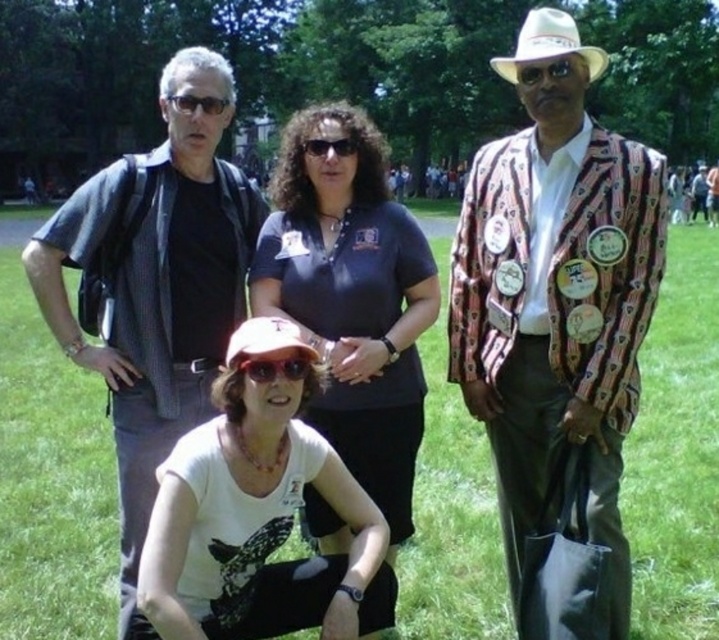
Can you confirm if white matte t-shirt at lower center is taller than shiny silver goggles at center?

Yes, white matte t-shirt at lower center is taller than shiny silver goggles at center.

The width and height of the screenshot is (719, 640). I want to click on white matte t-shirt at lower center, so click(x=252, y=512).

The height and width of the screenshot is (640, 719). In order to click on white matte t-shirt at lower center in this screenshot , I will do `click(252, 512)`.

Who is more forward, (645, 332) or (516, 67)?

Point (645, 332) is in front.

Does patterned fabric blazer at center have a lesser height compared to black plastic goggles at upper center?

No, patterned fabric blazer at center is not shorter than black plastic goggles at upper center.

Which is in front, point (562, 195) or point (582, 67)?

Point (582, 67) is in front.

Where is `patterned fabric blazer at center`? patterned fabric blazer at center is located at coordinates (557, 296).

Does green grass at center have a greater width compared to black plastic glasses at upper left?

Yes.

Which of these two, green grass at center or black plastic glasses at upper left, stands shorter?

black plastic glasses at upper left

Is point (470, 481) positioned behind point (193, 102)?

Yes, point (470, 481) is farther from viewer.

You are a GUI agent. You are given a task and a screenshot of the screen. Output one action in this format:
    pyautogui.click(x=<x>, y=<y>)
    Task: Click on the green grass at center
    
    Given the screenshot: What is the action you would take?
    pyautogui.click(x=50, y=481)